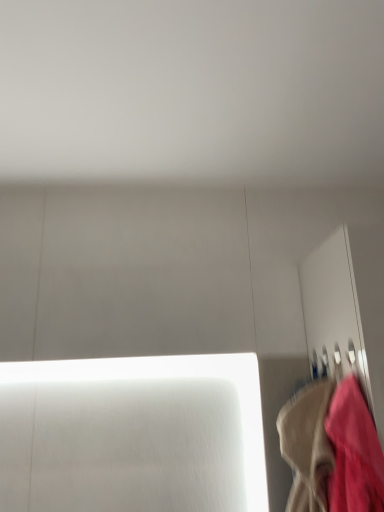
This screenshot has height=512, width=384. In order to click on velvet pink fabric at right in this screenshot , I will do `click(332, 448)`.

This screenshot has width=384, height=512. What do you see at coordinates (332, 448) in the screenshot? I see `velvet pink fabric at right` at bounding box center [332, 448].

Measure the distance between velvet pink fabric at right and camera.

36.26 inches.

Identify the location of velvet pink fabric at right. (332, 448).